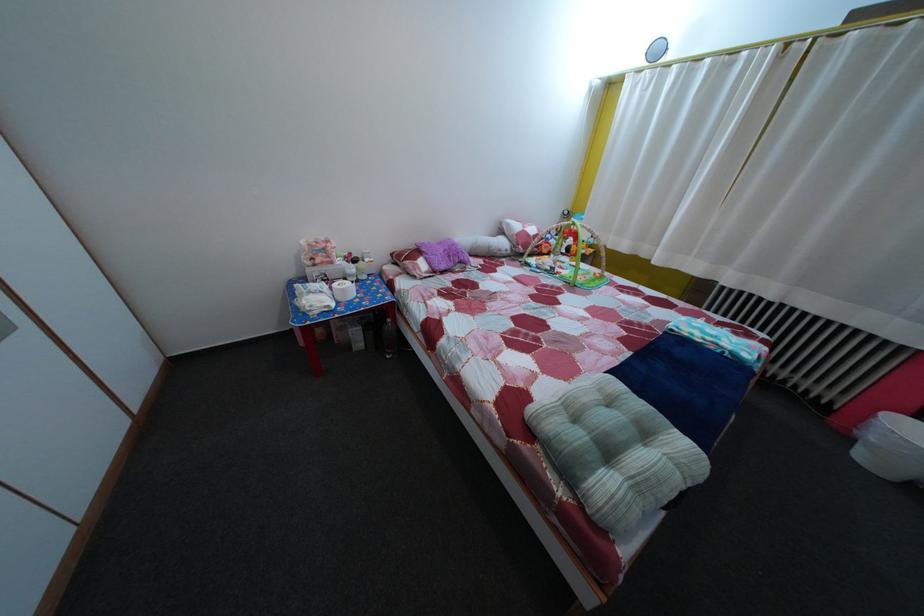
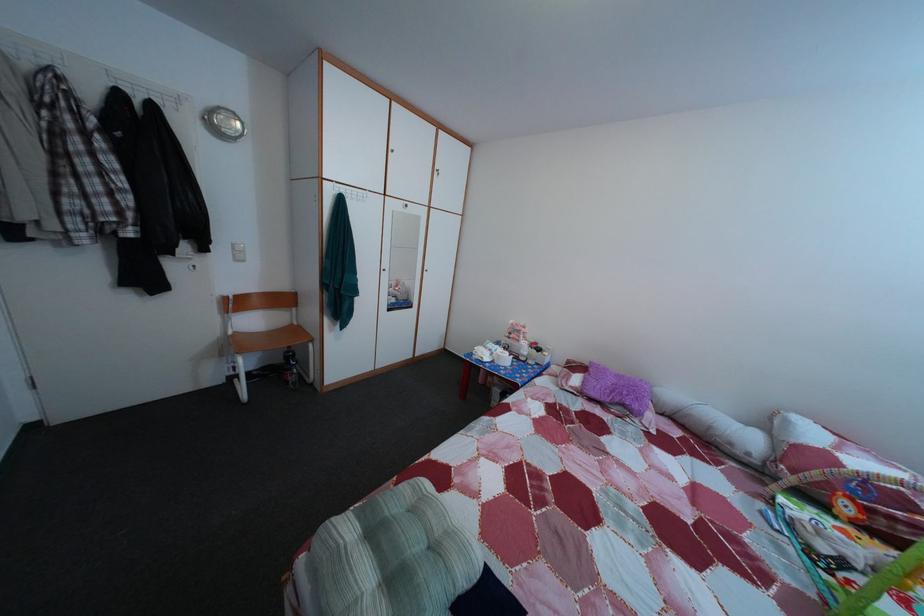
The point at (468, 274) is marked in the first image. Where is the corresponding point in the second image?

(628, 416)